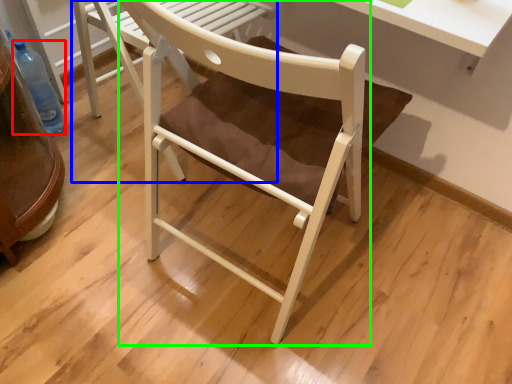
Question: Which is farther away from bottle (highlighted by a red box)? chair (highlighted by a blue box) or chair (highlighted by a green box)?

Choices:
 (A) chair
 (B) chair

Answer: (B)